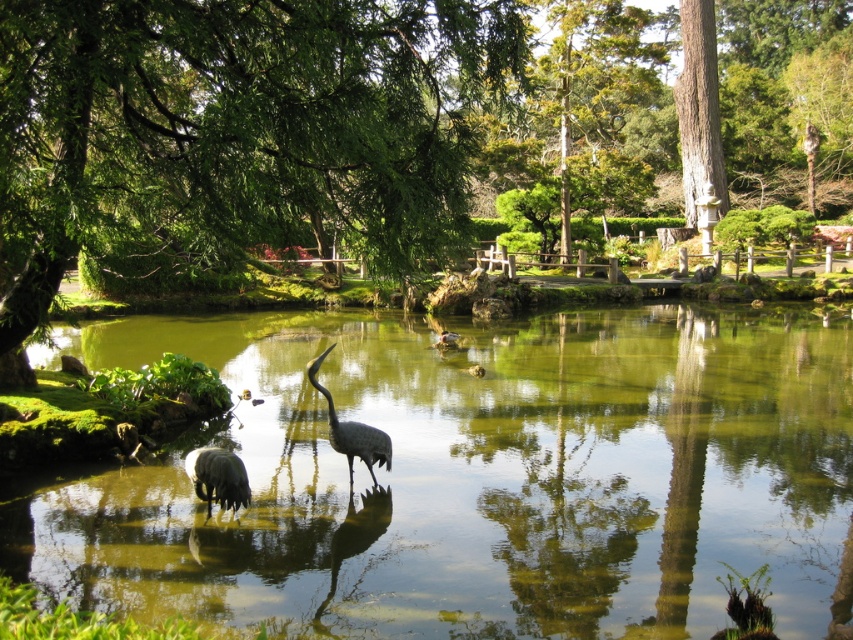
Consider the image. Is gray matte bird at center in front of gray matte heron at center?

Yes.

Measure the distance between gray matte bird at center and gray matte heron at center.

gray matte bird at center and gray matte heron at center are 1.16 meters apart.

The height and width of the screenshot is (640, 853). I want to click on gray matte bird at center, so click(x=218, y=477).

The image size is (853, 640). What do you see at coordinates (477, 476) in the screenshot?
I see `green reflective water at center` at bounding box center [477, 476].

Looking at this image, does green reflective water at center appear over green leafy tree at center?

Actually, green reflective water at center is below green leafy tree at center.

Who is more distant from viewer, (625, 307) or (258, 166)?

The point (625, 307) is behind.

Where is `green reflective water at center`? The image size is (853, 640). green reflective water at center is located at coordinates pyautogui.click(x=477, y=476).

Between green leafy tree at center and gray matte bird at center, which one is positioned lower?

gray matte bird at center is lower down.

What do you see at coordinates (236, 129) in the screenshot? I see `green leafy tree at center` at bounding box center [236, 129].

Who is more forward, (173, 97) or (184, 467)?

Point (184, 467) is more forward.

Where is `green leafy tree at center`? green leafy tree at center is located at coordinates (236, 129).